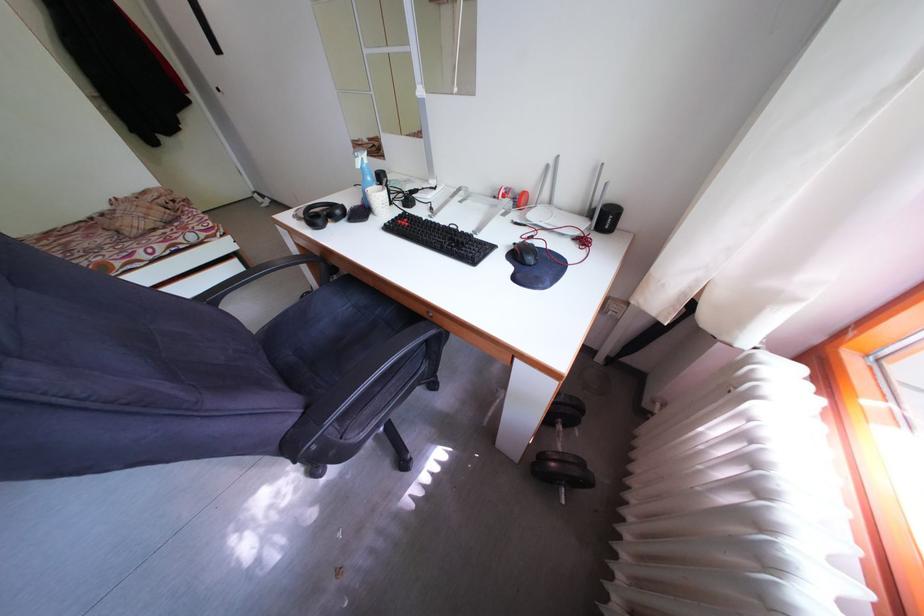
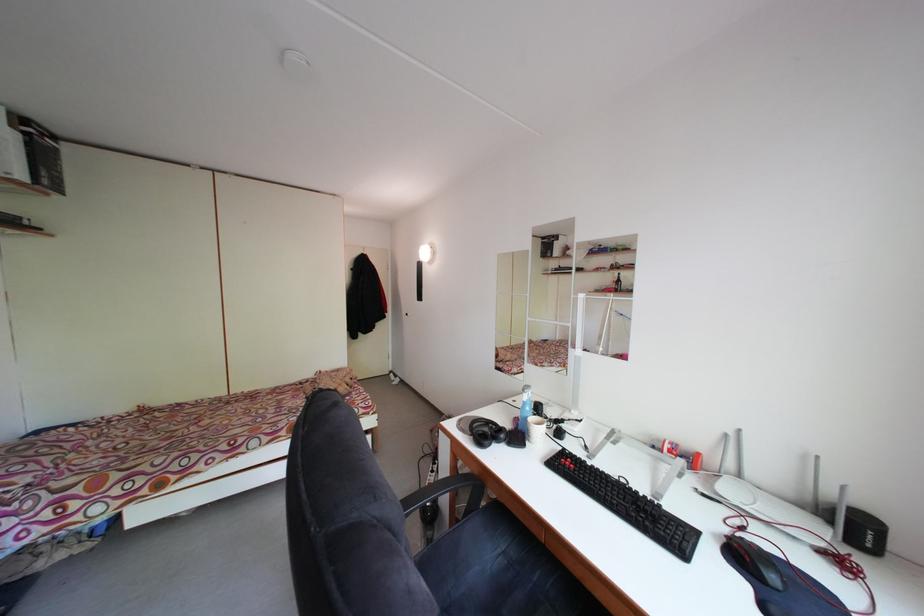
Find the pixel in the second image that matches the point at 527,246 in the first image.

(735, 536)